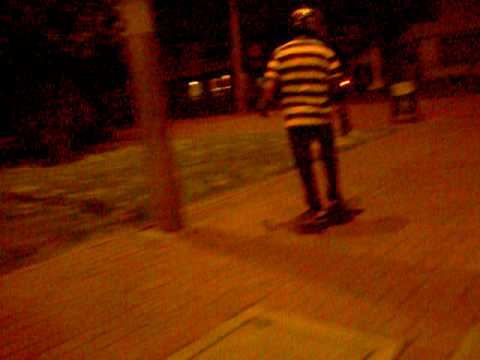
Find the location of a particular element. windows is located at coordinates (221, 84), (195, 90).